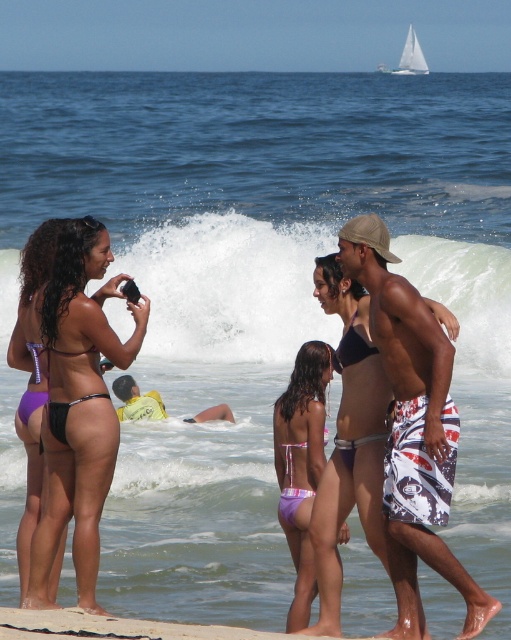
Question: Which point is farther to the camera?

Choices:
 (A) (499, 298)
 (B) (24, 412)
 (C) (397, 438)

Answer: (A)

Question: Among these objects, which one is nearest to the camera?

Choices:
 (A) yellow fabric shirt at lower center
 (B) purple shiny bikini at center
 (C) purple matte bikini at left
 (D) black matte bikini at center

Answer: (D)

Question: Does printed board shorts at center appear over purple shiny bikini at center?

Choices:
 (A) yes
 (B) no

Answer: (A)

Question: Can you confirm if printed board shorts at center is positioned below matte black bikini at center?

Choices:
 (A) yes
 (B) no

Answer: (A)

Question: Is purple matte bikini bottom at left wider than purple bikini bottom at center?

Choices:
 (A) yes
 (B) no

Answer: (A)

Question: Estimate the real-world distances between objects in this image. Which object is farther from the purple bikini bottom at center?

Choices:
 (A) white frothy wave at center
 (B) purple matte bikini bottom at left

Answer: (A)